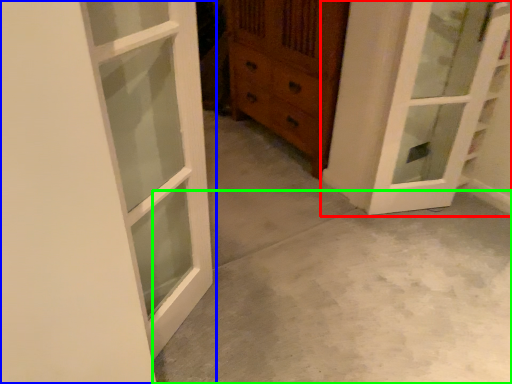
Question: Estimate the real-world distances between objects in this image. Which object is farther from door (highlighted by a red box), door (highlighted by a blue box) or concrete (highlighted by a green box)?

Choices:
 (A) door
 (B) concrete

Answer: (A)